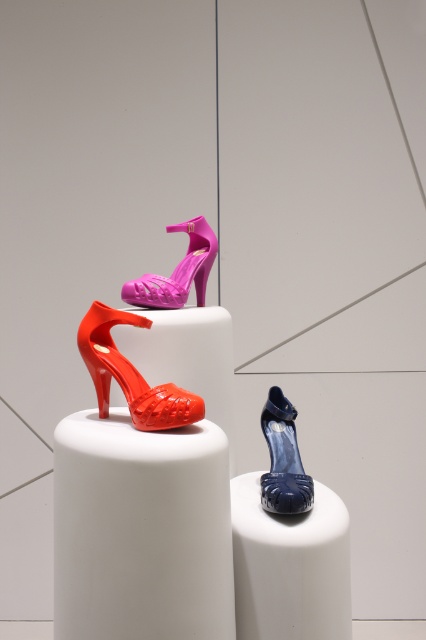
Is rubber-like red high-heeled shoe at left above glossy blue high-heeled shoe at center?

Yes.

Is rubber-like red high-heeled shoe at left positioned behind glossy blue high-heeled shoe at center?

That is False.

Find the location of a particular element. The image size is (426, 640). rubber-like red high-heeled shoe at left is located at coordinates (131, 374).

Identify the location of rubber-like red high-heeled shoe at left. The width and height of the screenshot is (426, 640). (131, 374).

How distant is rubber-like red high-heeled shoe at left from pink matte sandal at center?

A distance of 16.37 inches exists between rubber-like red high-heeled shoe at left and pink matte sandal at center.

Is rubber-like red high-heeled shoe at left above pink matte sandal at center?

No.

You are a GUI agent. You are given a task and a screenshot of the screen. Output one action in this format:
    pyautogui.click(x=<x>, y=<y>)
    Task: Click on the rubber-like red high-heeled shoe at left
    
    Given the screenshot: What is the action you would take?
    pyautogui.click(x=131, y=374)

At what (x,y) coordinates should I click in order to perform the action: click on rubber-like red high-heeled shoe at left. Please return your answer as a coordinate pair (x, y). The width and height of the screenshot is (426, 640). Looking at the image, I should click on (131, 374).

Between glossy blue high-heeled shoe at center and pink matte sandal at center, which one is positioned lower?

Positioned lower is glossy blue high-heeled shoe at center.

Based on the photo, who is more forward, [290,461] or [175,298]?

Point [290,461]

You are a GUI agent. You are given a task and a screenshot of the screen. Output one action in this format:
    pyautogui.click(x=<x>, y=<y>)
    Task: Click on the glossy blue high-heeled shoe at center
    Image resolution: width=426 pixels, height=640 pixels.
    Given the screenshot: What is the action you would take?
    pyautogui.click(x=282, y=458)